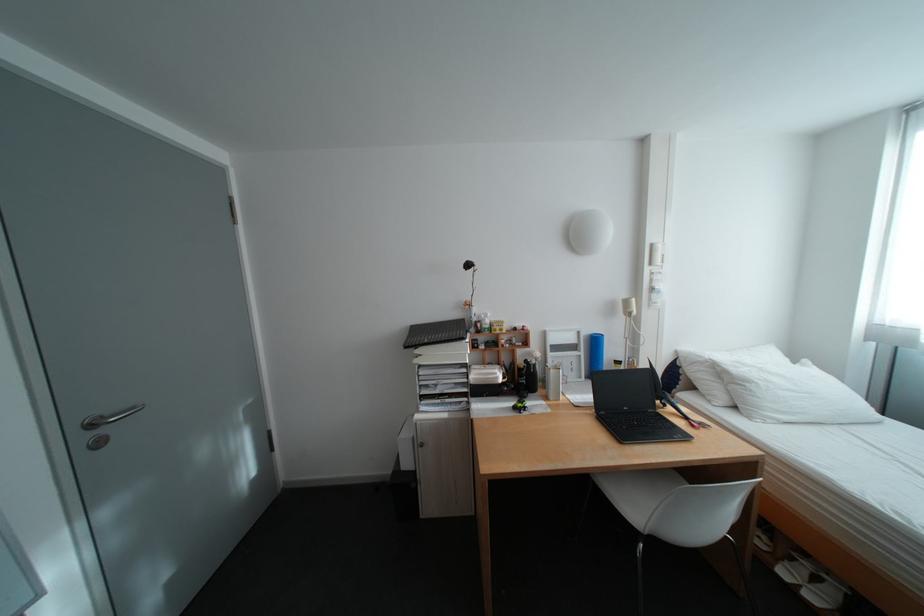
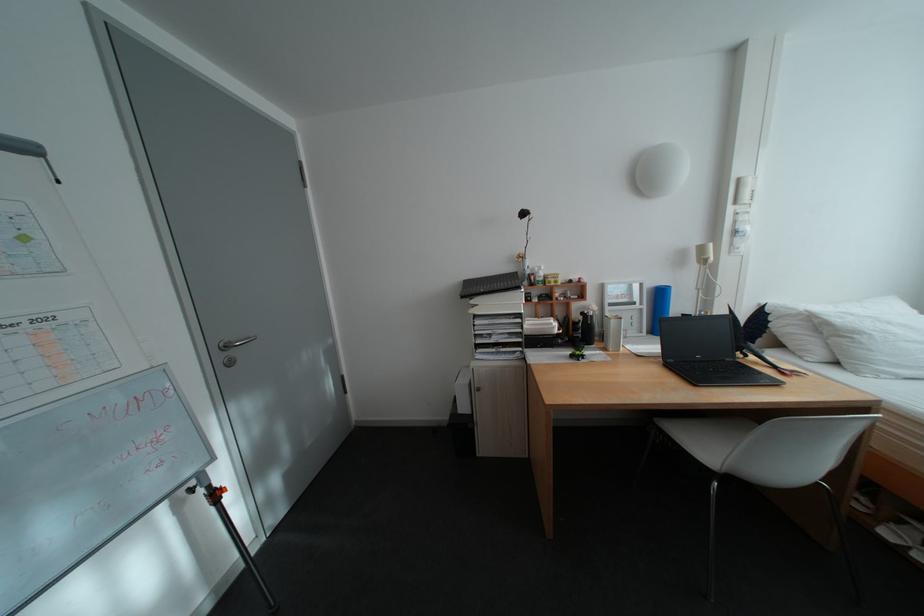
Locate, in the second image, the point that corresponds to point 645,533 in the first image.

(718, 472)